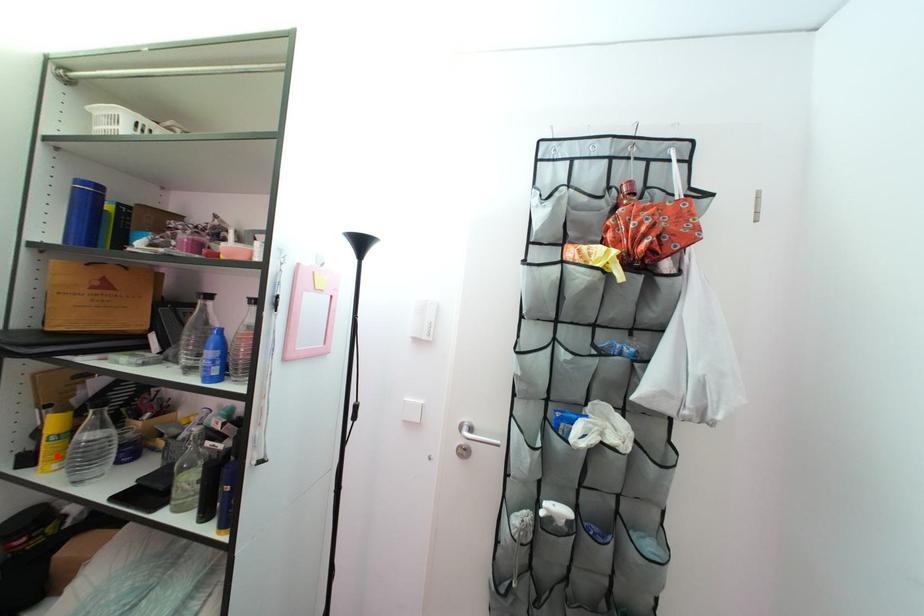
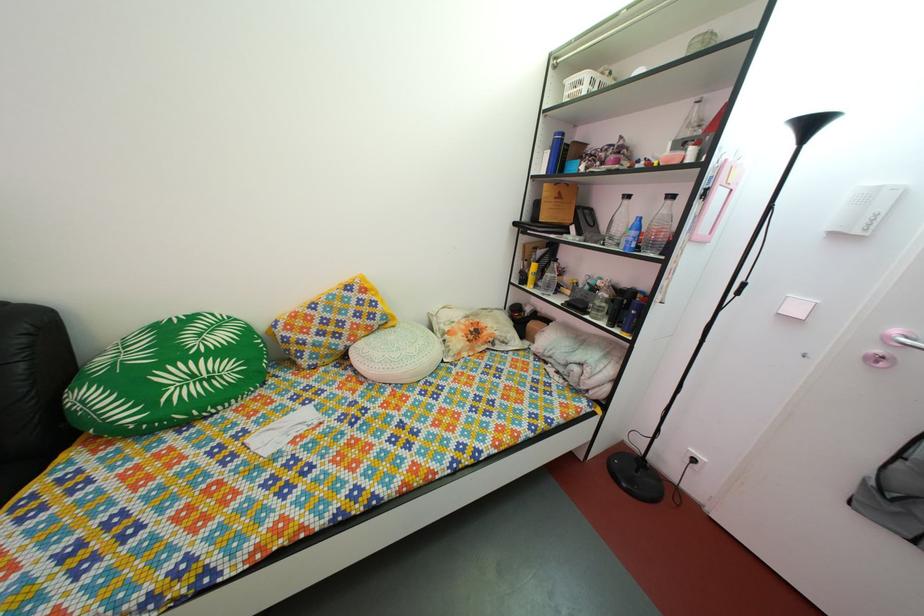
Find the pixel in the second image that matches the highlighted location in the first image.

(540, 286)